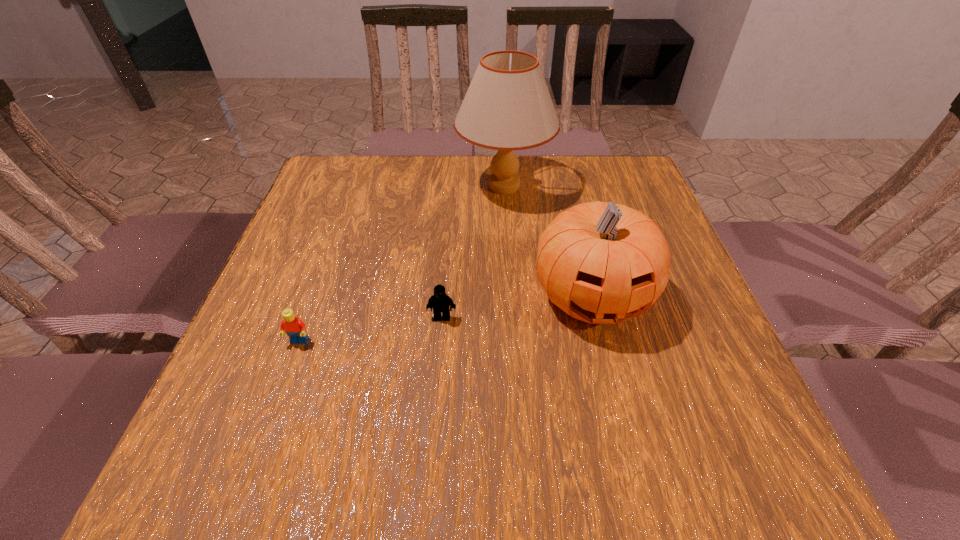
Locate an element on the screen. object that is at the far edge is located at coordinates (507, 107).

Identify the location of object that is at the left edge. The width and height of the screenshot is (960, 540). (294, 327).

Image resolution: width=960 pixels, height=540 pixels. In order to click on object present at the right edge in this screenshot , I will do click(600, 262).

In the image, there is a desktop. Find the location of `free space at the far edge`. free space at the far edge is located at coordinates (378, 181).

Locate an element on the screen. This screenshot has height=540, width=960. free space at the near edge is located at coordinates (495, 444).

Locate an element on the screen. The width and height of the screenshot is (960, 540). vacant space at the left edge of the desktop is located at coordinates (290, 241).

Where is `vacant space at the right edge of the desktop`? This screenshot has width=960, height=540. vacant space at the right edge of the desktop is located at coordinates (661, 220).

This screenshot has width=960, height=540. Identify the location of vacant space at the far left corner of the desktop. (338, 166).

Locate an element on the screen. The image size is (960, 540). blank space at the near left corner is located at coordinates (228, 463).

I want to click on vacant space at the far right corner, so click(634, 194).